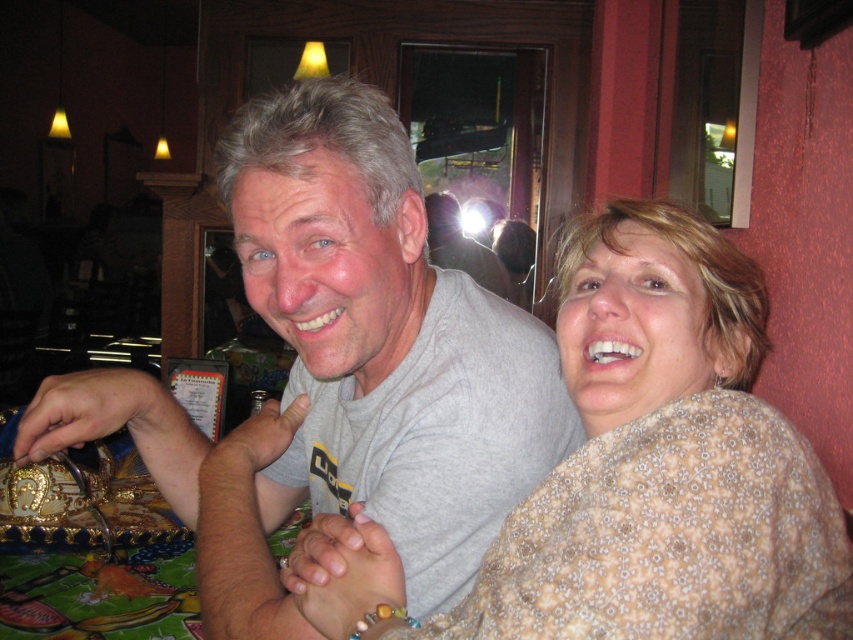
Question: Which of the following is the farthest from the observer?

Choices:
 (A) (701, 544)
 (B) (357, 371)

Answer: (B)

Question: Where is gray cotton t-shirt at center located in relation to floral-patterned blouse at center in the image?

Choices:
 (A) left
 (B) right

Answer: (A)

Question: Is gray cotton t-shirt at center wider than floral-patterned blouse at center?

Choices:
 (A) no
 (B) yes

Answer: (B)

Question: From the image, what is the correct spatial relationship of gray cotton t-shirt at center in relation to floral-patterned blouse at center?

Choices:
 (A) above
 (B) below

Answer: (A)

Question: Among these points, which one is farthest from the camera?

Choices:
 (A) (611, 337)
 (B) (561, 454)

Answer: (B)